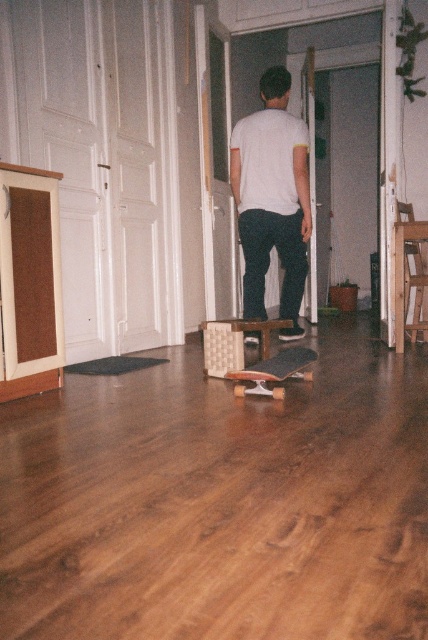
Is white matte shirt at upper center thinner than wooden skateboard at center?

Incorrect, white matte shirt at upper center's width is not less than wooden skateboard at center's.

Between white matte shirt at upper center and wooden skateboard at center, which one is positioned lower?

Positioned lower is wooden skateboard at center.

Measure the distance between point (288, 209) and camera.

Point (288, 209) and camera are 3.98 meters apart from each other.

Identify the location of white matte shirt at upper center. (272, 198).